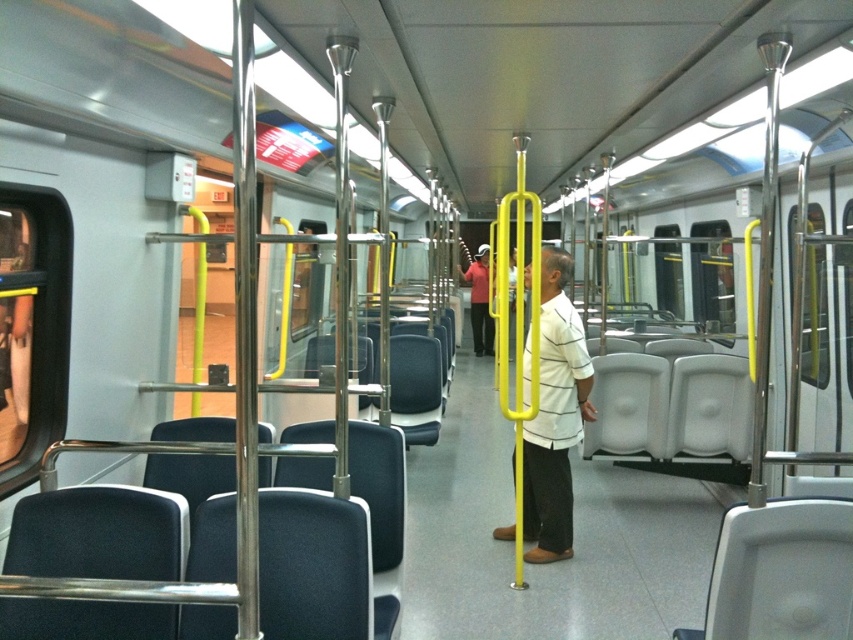
Is the position of white striped shirt at center more distant than that of matte red shirt at center?

No, it is not.

What do you see at coordinates (554, 416) in the screenshot? I see `white striped shirt at center` at bounding box center [554, 416].

The image size is (853, 640). In order to click on white striped shirt at center in this screenshot , I will do `click(554, 416)`.